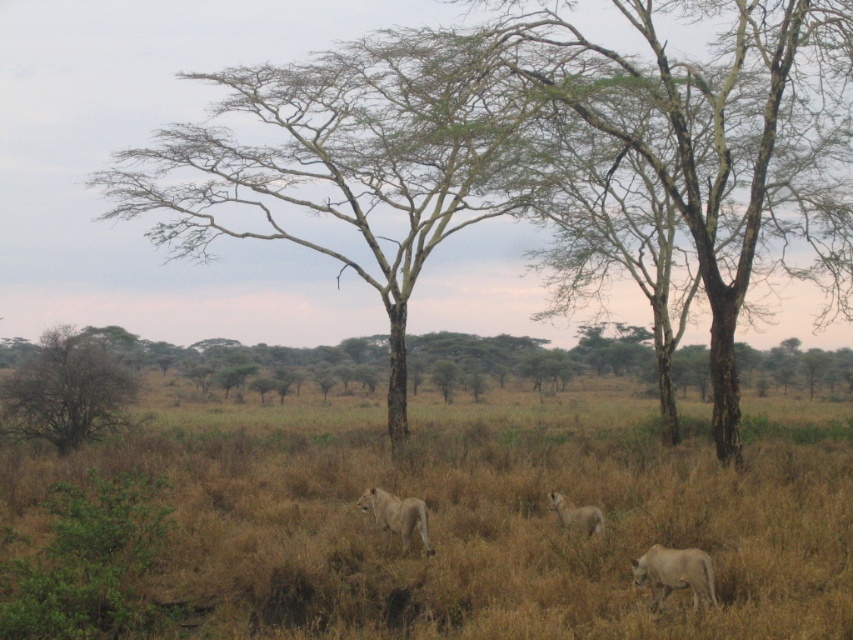
You are standing at the point marked as point (397, 515) in the savanna scene. Looking around, you see golden fur lion at center. Which direction should you move to get closer to the golden fur lion at center?

The point (397, 515) is already on the golden fur lion at center, so you are already at the location of the lion.

You are a safari guide leading a tour van that needs to pass through the savanna. The van is 2 meters wide. There are two lions, the golden fur lion at center and the light brown fur lion at center. Can the van safely pass between them without disturbing them?

The golden fur lion at center is to the left of the light brown fur lion at center. Since the distance between them isn not specified, it is impossible to determine if the van can safely pass. Please check the distance between them first.

You are standing at the point marked as point (80, 380) in the savanna scene. A lion is approaching you from the direction of the two lions walking away from the camera. If the lion moves at a speed of 5 meters per second, how many seconds will it take for the lion to reach you?

The distance between point (80, 380) and the viewer is 33.29 meters. Since the lion is moving towards you at 5 meters per second, it will take 33.29 divided by 5, which is approximately 6.66 seconds for the lion to reach you.